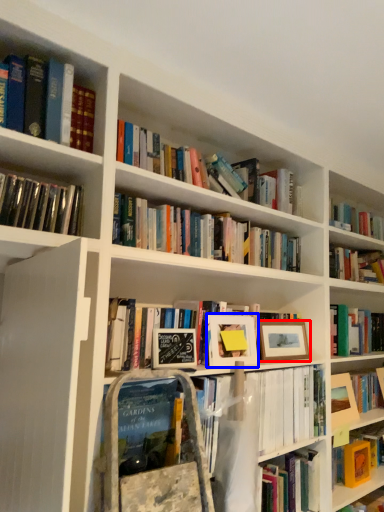
Question: Which object appears farthest to the camera in this image, picture frame (highlighted by a red box) or picture frame (highlighted by a blue box)?

Choices:
 (A) picture frame
 (B) picture frame

Answer: (A)